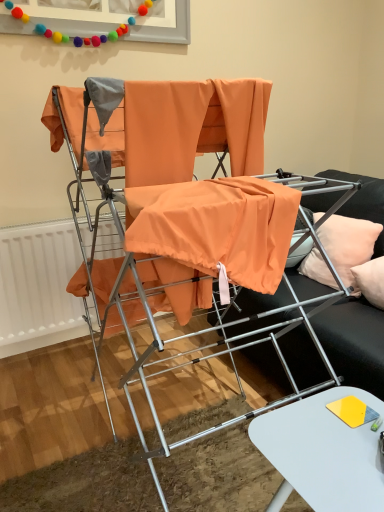
Question: Looking at their shapes, would you say peach fabric pillow at right is wider or thinner than orange fabric at center?

Choices:
 (A) wide
 (B) thin

Answer: (B)

Question: From the image's perspective, is peach fabric pillow at right positioned above or below orange fabric at center?

Choices:
 (A) below
 (B) above

Answer: (B)

Question: Which of these objects is positioned closest to the orange fabric chair at center?

Choices:
 (A) orange fabric at center
 (B) peach fabric pillow at right
 (C) white glossy table at lower right
 (D) white matte radiator at lower left
 (E) orange fabric at center

Answer: (E)

Question: Which of these objects is positioned farthest from the white glossy table at lower right?

Choices:
 (A) peach fabric pillow at right
 (B) orange fabric chair at center
 (C) orange fabric at center
 (D) orange fabric at center
 (E) white matte radiator at lower left

Answer: (E)